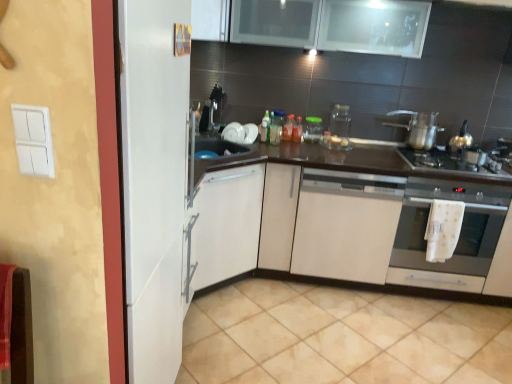
You are a GUI agent. You are given a task and a screenshot of the screen. Output one action in this format:
    pyautogui.click(x=<x>, y=<y>)
    Task: Click on the vacant region above beige tile at lower center (from a real-world perspective)
    
    Given the screenshot: What is the action you would take?
    pyautogui.click(x=356, y=323)